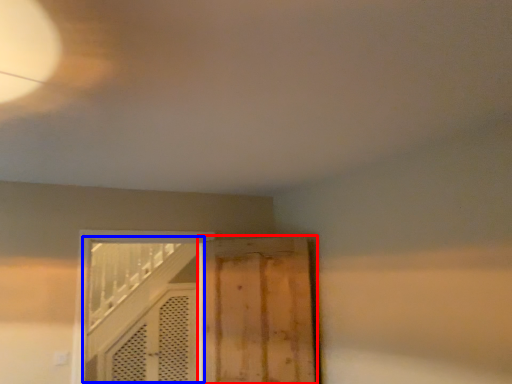
Question: Which object is closer to the camera taking this photo, door (highlighted by a red box) or door (highlighted by a blue box)?

Choices:
 (A) door
 (B) door

Answer: (B)